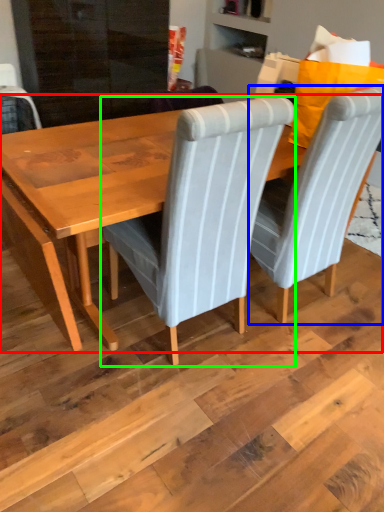
Question: Considering the real-world distances, which object is farthest from table (highlighted by a red box)? chair (highlighted by a blue box) or chair (highlighted by a green box)?

Choices:
 (A) chair
 (B) chair

Answer: (A)